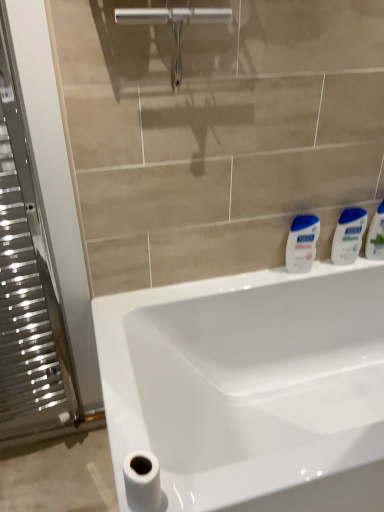
Where is `white glossy lotion at right`? This screenshot has height=512, width=384. white glossy lotion at right is located at coordinates (302, 243).

What is the approximate height of silver metallic tap at upper center?

silver metallic tap at upper center is 17.79 centimeters in height.

Where is `white glossy lotion at right, which is counted as the second toiletry, starting from the left`? Image resolution: width=384 pixels, height=512 pixels. white glossy lotion at right, which is counted as the second toiletry, starting from the left is located at coordinates (376, 234).

Find the location of a particular element. This screenshot has width=384, height=512. white glossy lotion at right is located at coordinates (302, 243).

In the image, is white glossy lotion at right, which is counted as the second toiletry, starting from the left, positioned in front of or behind white glossy sink at center?

Clearly, white glossy lotion at right, which is counted as the second toiletry, starting from the left, is behind white glossy sink at center.

Is white glossy lotion at right, the 1th toiletry in the right-to-left sequence, smaller than white glossy sink at center?

Correct, white glossy lotion at right, the 1th toiletry in the right-to-left sequence, occupies less space than white glossy sink at center.

In the scene shown: From a real-world perspective, is white glossy lotion at right, the 1th toiletry in the right-to-left sequence, positioned under white glossy sink at center based on gravity?

No, from a real-world perspective, white glossy lotion at right, the 1th toiletry in the right-to-left sequence, is not under white glossy sink at center.

Based on the photo, from their relative heights in the image, would you say white glossy lotion at right, the 1th toiletry in the right-to-left sequence, is taller or shorter than white glossy sink at center?

Considering their sizes, white glossy lotion at right, the 1th toiletry in the right-to-left sequence, has less height than white glossy sink at center.

Considering the sizes of white matte toilet paper at lower left and silver metallic radiator at left in the image, is white matte toilet paper at lower left taller or shorter than silver metallic radiator at left?

Considering their sizes, white matte toilet paper at lower left has less height than silver metallic radiator at left.

Is white matte toilet paper at lower left looking in the opposite direction of silver metallic radiator at left?

No.

Choose the correct answer: Is white matte toilet paper at lower left inside silver metallic radiator at left or outside it?

white matte toilet paper at lower left is not enclosed by silver metallic radiator at left.

Which is in front, point (147, 502) or point (14, 114)?

Point (147, 502)

Which point is more distant from viewer, [150,448] or [187,14]?

The point [187,14] is more distant.

Consider the image. Considering the relative sizes of white glossy sink at center and silver metallic tap at upper center in the image provided, is white glossy sink at center shorter than silver metallic tap at upper center?

In fact, white glossy sink at center may be taller than silver metallic tap at upper center.

Is white glossy sink at center surrounding silver metallic tap at upper center?

No.

From a real-world perspective, between white glossy sink at center and white glossy lotion at right, arranged as the first toiletry when viewed from the left, who is vertically lower?

white glossy sink at center is physically lower.

Between white glossy sink at center and white glossy lotion at right, the second toiletry in the right-to-left sequence, which one has smaller size?

Smaller between the two is white glossy lotion at right, the second toiletry in the right-to-left sequence.

Does point (293, 400) appear closer or farther from the camera than point (349, 250)?

Point (293, 400) is positioned closer to the camera compared to point (349, 250).

How distant is white glossy sink at center from white glossy lotion at right, arranged as the first toiletry when viewed from the left?

18.89 inches.

Is the surface of silver metallic radiator at left in direct contact with white matte toilet paper at lower left?

They are not placed beside each other.

Looking at this image, considering the sizes of silver metallic radiator at left and white matte toilet paper at lower left in the image, is silver metallic radiator at left taller or shorter than white matte toilet paper at lower left?

Considering their sizes, silver metallic radiator at left has more height than white matte toilet paper at lower left.

Between silver metallic radiator at left and white matte toilet paper at lower left, which one has larger width?

With larger width is silver metallic radiator at left.

Which object is closer to the camera, silver metallic radiator at left or white matte toilet paper at lower left?

white matte toilet paper at lower left is in front.

Is the depth of white glossy lotion at right, the second toiletry in the right-to-left sequence, greater than that of white glossy sink at center?

Yes, white glossy lotion at right, the second toiletry in the right-to-left sequence, is further from the camera.

From the picture: Can you confirm if white glossy lotion at right, the second toiletry in the right-to-left sequence, is taller than white glossy sink at center?

In fact, white glossy lotion at right, the second toiletry in the right-to-left sequence, may be shorter than white glossy sink at center.

Is white glossy lotion at right, arranged as the first toiletry when viewed from the left, looking in the opposite direction of white glossy sink at center?

No, white glossy sink at center is not at the back of white glossy lotion at right, arranged as the first toiletry when viewed from the left.

Which of these two, white glossy lotion at right, arranged as the first toiletry when viewed from the left, or white glossy sink at center, is bigger?

white glossy sink at center is bigger.

This screenshot has height=512, width=384. In the image, there is a silver metallic radiator at left. Find the location of `sink below it (from the image's perspective)`. sink below it (from the image's perspective) is located at coordinates (251, 388).

From the image's perspective, which is below, white glossy sink at center or silver metallic radiator at left?

white glossy sink at center is shown below in the image.

Considering the relative sizes of white glossy sink at center and silver metallic radiator at left in the image provided, is white glossy sink at center thinner than silver metallic radiator at left?

In fact, white glossy sink at center might be wider than silver metallic radiator at left.

Does white glossy sink at center appear on the left side of silver metallic radiator at left?

No, white glossy sink at center is not to the left of silver metallic radiator at left.

The image size is (384, 512). Identify the location of the 2nd toiletry positioned above the white glossy sink at center (from a real-world perspective). (376, 234).

At what (x,y) coordinates should I click in order to perform the action: click on toilet paper in front of the silver metallic radiator at left. Please return your answer as a coordinate pair (x, y). This screenshot has height=512, width=384. Looking at the image, I should click on (142, 480).

Which object lies nearer to the anchor point white glossy lotion at right, silver metallic tap at upper center or white glossy lotion at right, arranged as the first toiletry when viewed from the left?

Based on the image, white glossy lotion at right, arranged as the first toiletry when viewed from the left, appears to be nearer to white glossy lotion at right.

When comparing their distances from white glossy lotion at right, the 1th toiletry in the right-to-left sequence, does white glossy sink at center or white glossy lotion at right seem closer?

white glossy lotion at right.

Which object lies nearer to the anchor point white glossy sink at center, white glossy lotion at right, the 1th toiletry in the right-to-left sequence, or silver metallic radiator at left?

white glossy lotion at right, the 1th toiletry in the right-to-left sequence.

Considering their positions, is white matte toilet paper at lower left positioned further to white glossy lotion at right than white glossy sink at center?

white matte toilet paper at lower left lies further to white glossy lotion at right than the other object.

When comparing their distances from white matte toilet paper at lower left, does silver metallic radiator at left or white glossy lotion at right, arranged as the first toiletry when viewed from the left, seem further?

white glossy lotion at right, arranged as the first toiletry when viewed from the left, is further to white matte toilet paper at lower left.

From the image, which object appears to be farther from silver metallic radiator at left, white glossy lotion at right, arranged as the first toiletry when viewed from the left, or silver metallic tap at upper center?

white glossy lotion at right, arranged as the first toiletry when viewed from the left.

Which object lies nearer to the anchor point white glossy lotion at right, the second toiletry in the right-to-left sequence, white glossy lotion at right, which is counted as the second toiletry, starting from the left, or white glossy lotion at right?

white glossy lotion at right, which is counted as the second toiletry, starting from the left, is positioned closer to the anchor white glossy lotion at right, the second toiletry in the right-to-left sequence.

When comparing their distances from white glossy lotion at right, which is counted as the second toiletry, starting from the left, does silver metallic radiator at left or white matte toilet paper at lower left seem further?

silver metallic radiator at left is positioned further to the anchor white glossy lotion at right, which is counted as the second toiletry, starting from the left.

This screenshot has height=512, width=384. I want to click on toilet paper situated between silver metallic radiator at left and white glossy lotion at right, arranged as the first toiletry when viewed from the left, from left to right, so click(142, 480).

Identify the location of toilet paper between silver metallic radiator at left and white glossy sink at center from left to right. (142, 480).

Identify the location of sink positioned between white matte toilet paper at lower left and white glossy lotion at right, arranged as the first toiletry when viewed from the left, from near to far. The image size is (384, 512). (251, 388).

Find the location of a particular element. This screenshot has width=384, height=512. toiletry situated between silver metallic tap at upper center and white glossy lotion at right, which is counted as the second toiletry, starting from the left, from left to right is located at coordinates (348, 234).